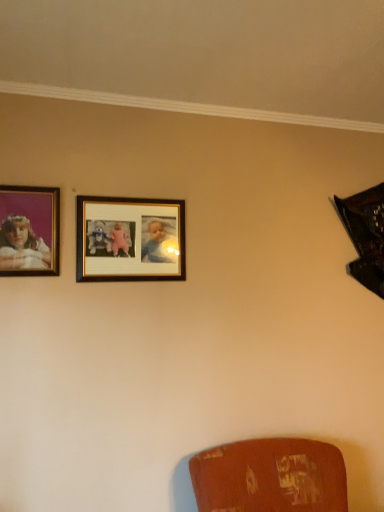
What is the approximate width of gold-framed photo at center?

It is 0.95 inches.

The image size is (384, 512). What do you see at coordinates (130, 239) in the screenshot?
I see `gold-framed photo at center` at bounding box center [130, 239].

This screenshot has height=512, width=384. I want to click on gold-framed photo at center, so click(x=130, y=239).

Where is `gold-framed photo at center`? gold-framed photo at center is located at coordinates (130, 239).